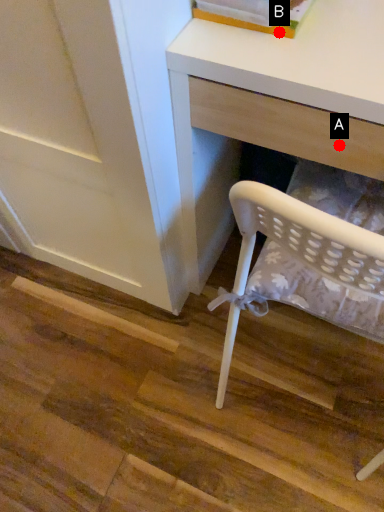
Question: Two points are circled on the image, labeled by A and B beside each circle. Among these points, which one is nearest to the camera?

Choices:
 (A) A is closer
 (B) B is closer

Answer: (B)